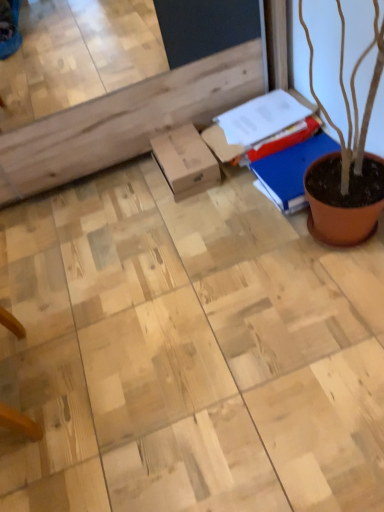
The image size is (384, 512). I want to click on vacant point above cardboard box at center (from a real-world perspective), so click(180, 148).